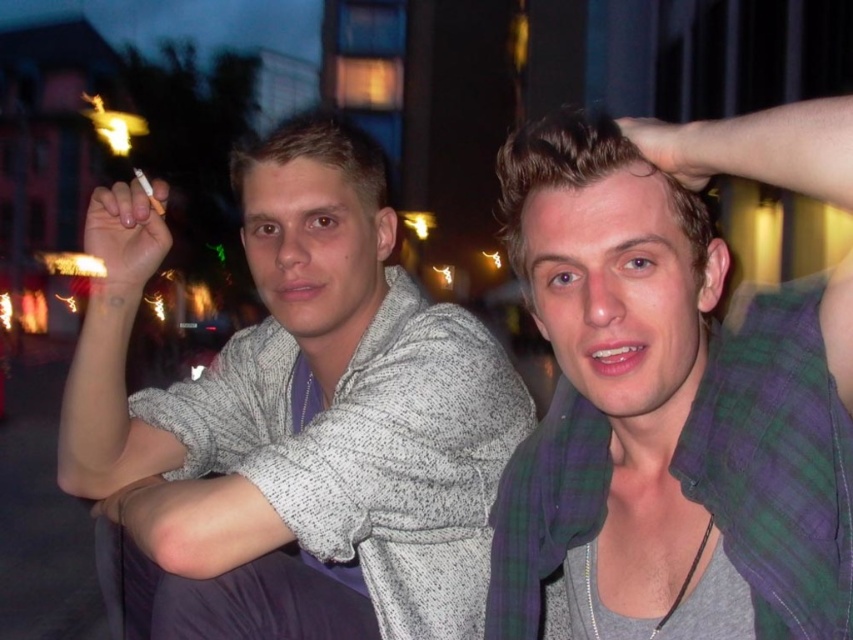
You are standing at the point labeled point (750,164) and want to move towards the point labeled point (573,600). Given that both points are in the same plane, will you be moving forward or backward relative to your current position?

Since point (573,600) is behind point (750,164), moving towards it would require moving backward relative to your current position at point (750,164).

You are a photographer standing in the scene wanting to capture both the white matte cigarette at upper left and the smooth skin hand at upper right in a single frame. Given that your camera has a 10 feet focal length, will you be able to include both in the shot without moving the camera?

The white matte cigarette at upper left and smooth skin hand at upper right are 9.21 feet apart. Since the camera has a 10 feet focal length, which is longer than the distance between the two objects, you can include both in the shot without moving the camera.

You are a photographer trying to capture a closeup shot of the green plaid scarf at upper right and the smooth skin hand at upper right. Which object is bigger in the image?

The green plaid scarf at upper right is larger in size than the smooth skin hand at upper right, so the green plaid scarf at upper right is bigger.